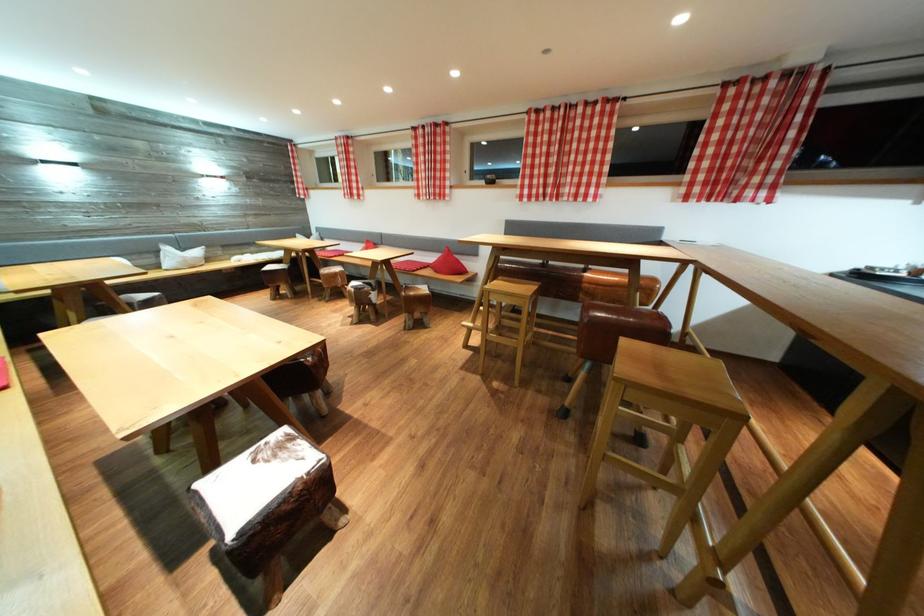
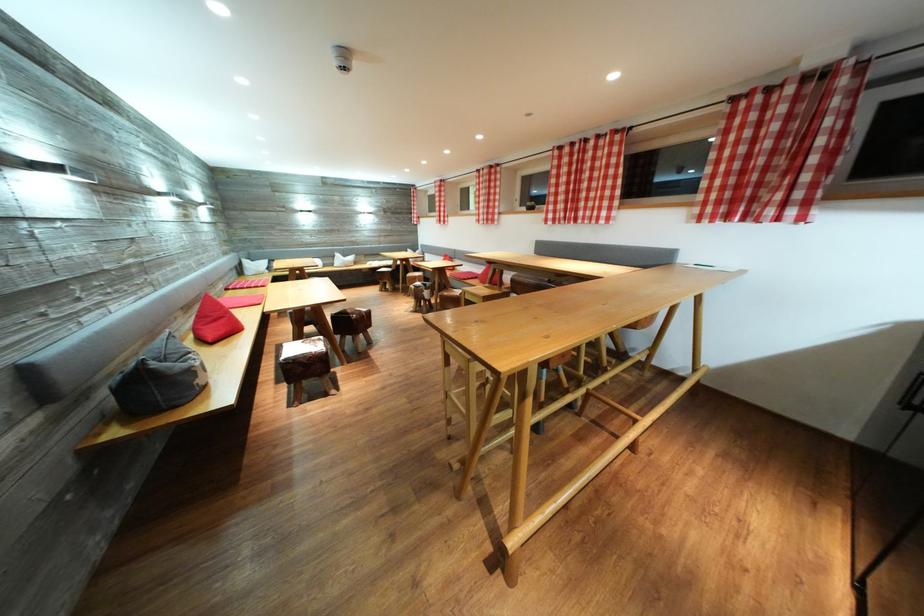
Locate, in the second image, the point that corresponds to the point at 286,293 in the first image.

(393, 289)